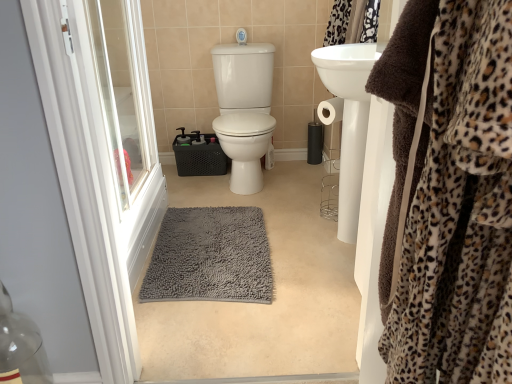
Locate an element on the screen. The height and width of the screenshot is (384, 512). empty space that is ontop of gray shaggy bath mat at center (from a real-world perspective) is located at coordinates (206, 244).